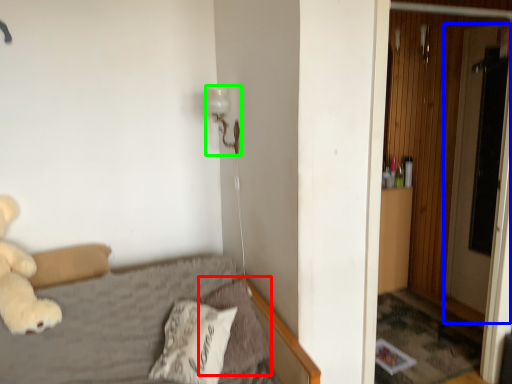
Question: Which object is positioned farthest from pillow (highlighted by a red box)? Select from screen door (highlighted by a blue box) and lamp (highlighted by a green box).

Choices:
 (A) screen door
 (B) lamp

Answer: (A)